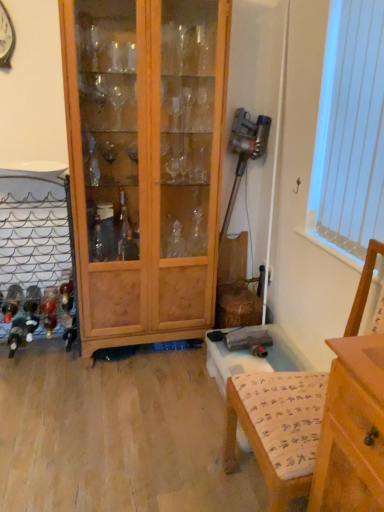
Question: From a real-world perspective, is wooden cabinet at center physically located above or below wooden armchair at lower right?

Choices:
 (A) below
 (B) above

Answer: (B)

Question: Based on their sizes in the image, would you say wooden cabinet at center is bigger or smaller than wooden armchair at lower right?

Choices:
 (A) small
 (B) big

Answer: (B)

Question: Which of these objects is positioned closest to the white vertical blinds at upper right?

Choices:
 (A) wooden cabinet at center
 (B) wooden armchair at lower right

Answer: (B)

Question: Which is nearer to the wooden armchair at lower right?

Choices:
 (A) wooden cabinet at center
 (B) white vertical blinds at upper right

Answer: (B)